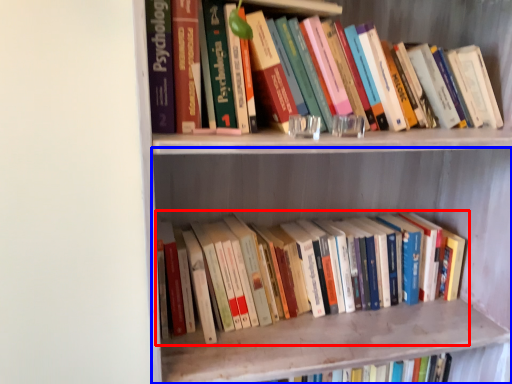
Question: Which point is closer to the camera, book (highlighted by a red box) or shelf (highlighted by a blue box)?

Choices:
 (A) book
 (B) shelf

Answer: (B)